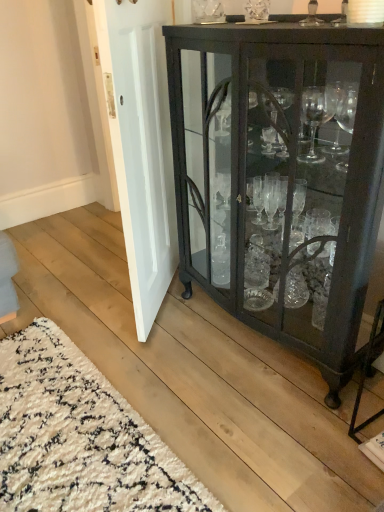
Question: Does matte black cabinet at right appear on the right side of white painted wood door at center?

Choices:
 (A) yes
 (B) no

Answer: (A)

Question: Is matte black cabinet at right behind white painted wood door at center?

Choices:
 (A) no
 (B) yes

Answer: (A)

Question: Can you confirm if matte black cabinet at right is wider than white painted wood door at center?

Choices:
 (A) yes
 (B) no

Answer: (A)

Question: Does matte black cabinet at right have a smaller size compared to white painted wood door at center?

Choices:
 (A) yes
 (B) no

Answer: (B)

Question: Considering the relative sizes of matte black cabinet at right and white painted wood door at center in the image provided, is matte black cabinet at right shorter than white painted wood door at center?

Choices:
 (A) yes
 (B) no

Answer: (A)

Question: In the image, is matte black cabinet at right positioned in front of or behind white painted wood door at center?

Choices:
 (A) behind
 (B) front

Answer: (B)

Question: Looking at the image, does matte black cabinet at right seem bigger or smaller compared to white painted wood door at center?

Choices:
 (A) big
 (B) small

Answer: (A)

Question: Considering the relative positions of matte black cabinet at right and white painted wood door at center in the image provided, is matte black cabinet at right to the left or to the right of white painted wood door at center?

Choices:
 (A) right
 (B) left

Answer: (A)

Question: Is matte black cabinet at right inside or outside of white painted wood door at center?

Choices:
 (A) inside
 (B) outside

Answer: (B)

Question: From the image's perspective, is matte black cabinet at right located above or below white shaggy rug at lower left?

Choices:
 (A) above
 (B) below

Answer: (A)

Question: Is point (307, 327) positioned closer to the camera than point (158, 478)?

Choices:
 (A) closer
 (B) farther

Answer: (B)

Question: Which is correct: matte black cabinet at right is inside white shaggy rug at lower left, or outside of it?

Choices:
 (A) outside
 (B) inside

Answer: (A)

Question: Considering the positions of matte black cabinet at right and white shaggy rug at lower left in the image, is matte black cabinet at right taller or shorter than white shaggy rug at lower left?

Choices:
 (A) short
 (B) tall

Answer: (B)

Question: From the image's perspective, is white painted wood door at center positioned above or below white shaggy rug at lower left?

Choices:
 (A) below
 (B) above

Answer: (B)

Question: Is white painted wood door at center to the left or to the right of white shaggy rug at lower left in the image?

Choices:
 (A) right
 (B) left

Answer: (A)